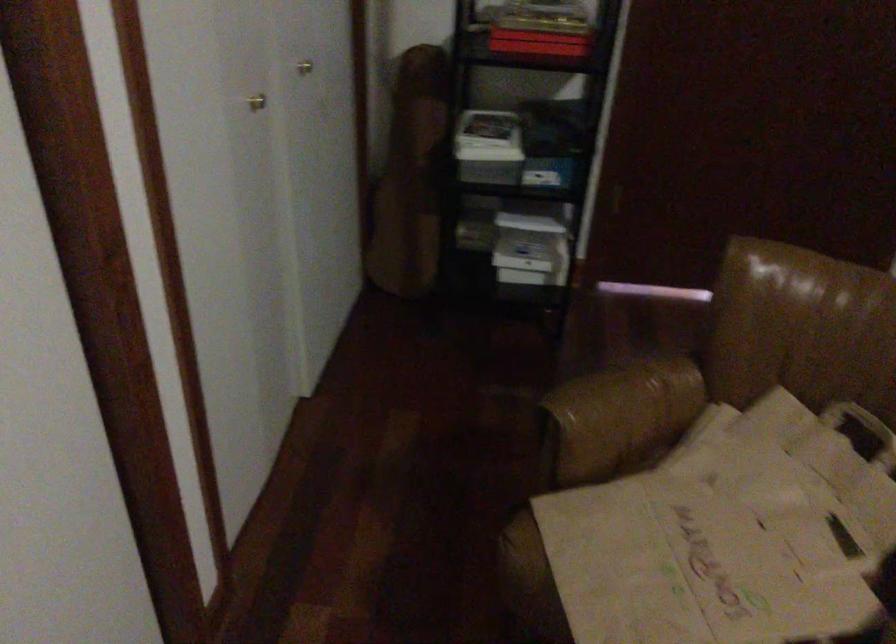
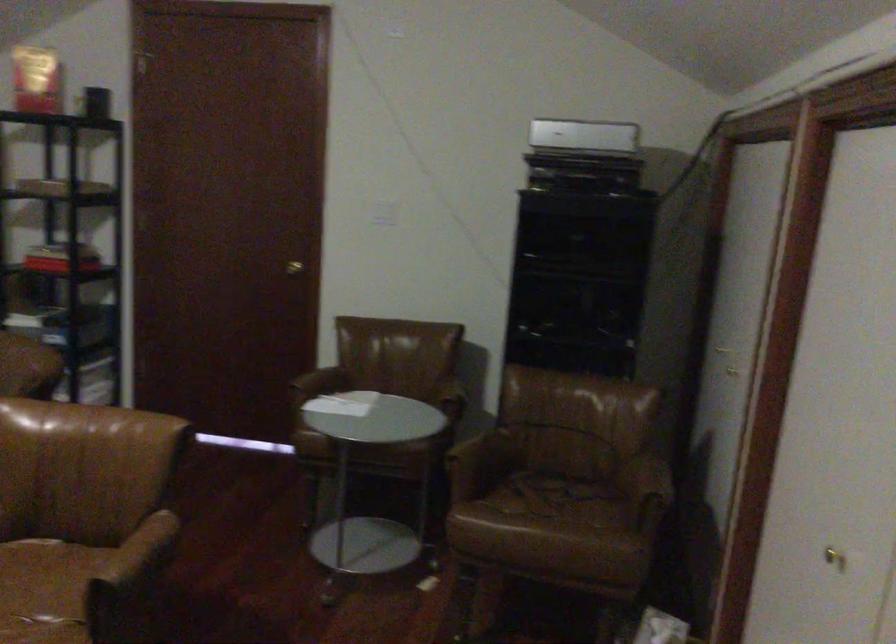
Based on the photo, what movement of the cameraman would produce the second image?

The movement direction of the cameraman is right, backward.